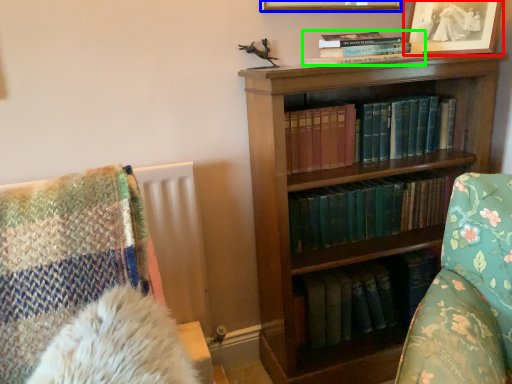
Question: Based on their relative distances, which object is nearer to picture frame (highlighted by a red box)? Choose from picture frame (highlighted by a blue box) and book (highlighted by a green box).

Choices:
 (A) picture frame
 (B) book

Answer: (A)